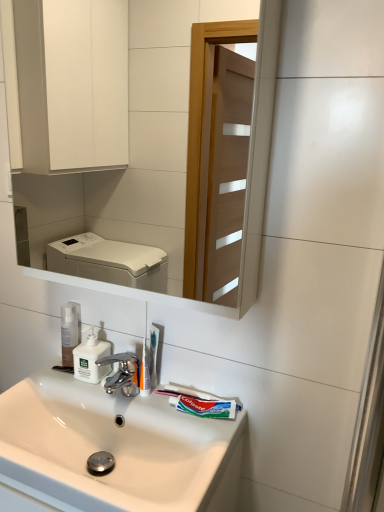
Find the location of a particular element. The width and height of the screenshot is (384, 512). free space to the left of white plastic soap dispenser at center is located at coordinates (54, 378).